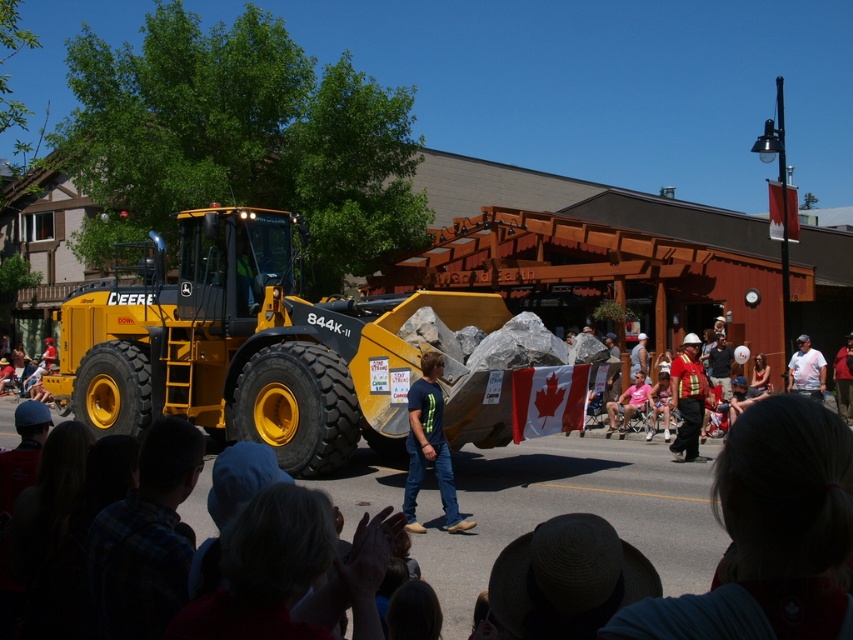
Locate an element on the screen. This screenshot has width=853, height=640. dark blue t-shirt at center is located at coordinates (428, 445).

Can you confirm if yellow metallic tractor at center is wider than dark blue t-shirt at center?

Indeed, yellow metallic tractor at center has a greater width compared to dark blue t-shirt at center.

Locate an element on the screen. The width and height of the screenshot is (853, 640). yellow metallic tractor at center is located at coordinates (247, 346).

I want to click on yellow metallic tractor at center, so click(x=247, y=346).

Based on the photo, is yellow metallic tractor at center shorter than white t-shirt at center?

Incorrect, yellow metallic tractor at center's height does not fall short of white t-shirt at center's.

Can you confirm if yellow metallic tractor at center is bigger than white t-shirt at center?

Yes.

This screenshot has width=853, height=640. What do you see at coordinates (247, 346) in the screenshot? I see `yellow metallic tractor at center` at bounding box center [247, 346].

The height and width of the screenshot is (640, 853). What are the coordinates of `yellow metallic tractor at center` in the screenshot? It's located at (247, 346).